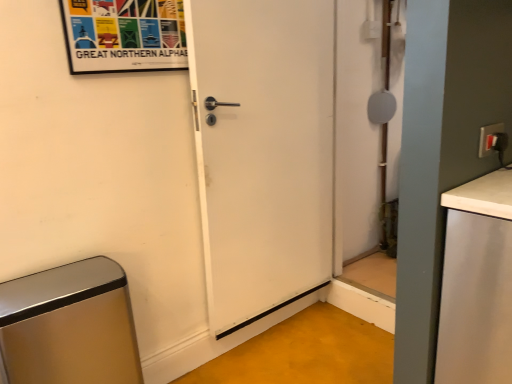
Question: From the image's perspective, is white matte countertop at right located beneath matte white switch at upper right?

Choices:
 (A) no
 (B) yes

Answer: (B)

Question: Can you confirm if white matte countertop at right is shorter than matte white switch at upper right?

Choices:
 (A) yes
 (B) no

Answer: (B)

Question: Can we say white matte countertop at right lies outside matte white switch at upper right?

Choices:
 (A) no
 (B) yes

Answer: (B)

Question: Is the depth of white matte countertop at right greater than that of matte white switch at upper right?

Choices:
 (A) yes
 (B) no

Answer: (B)

Question: Could you tell me if white matte countertop at right is facing matte white switch at upper right?

Choices:
 (A) no
 (B) yes

Answer: (A)

Question: Considering the relative positions of white matte countertop at right and matte white switch at upper right in the image provided, is white matte countertop at right in front of matte white switch at upper right?

Choices:
 (A) no
 (B) yes

Answer: (B)

Question: From the image's perspective, is matte white switch at upper right on white matte door at center?

Choices:
 (A) no
 (B) yes

Answer: (B)

Question: Is matte white switch at upper right next to white matte door at center?

Choices:
 (A) yes
 (B) no

Answer: (B)

Question: Considering the relative sizes of matte white switch at upper right and white matte door at center in the image provided, is matte white switch at upper right shorter than white matte door at center?

Choices:
 (A) yes
 (B) no

Answer: (A)

Question: Is matte white switch at upper right smaller than white matte door at center?

Choices:
 (A) yes
 (B) no

Answer: (A)

Question: Is the position of matte white switch at upper right more distant than that of white matte door at center?

Choices:
 (A) no
 (B) yes

Answer: (A)

Question: Considering the relative sizes of matte white switch at upper right and white matte door at center in the image provided, is matte white switch at upper right taller than white matte door at center?

Choices:
 (A) no
 (B) yes

Answer: (A)

Question: Can you confirm if metallic brushed trash can at lower left is taller than white matte countertop at right?

Choices:
 (A) no
 (B) yes

Answer: (A)